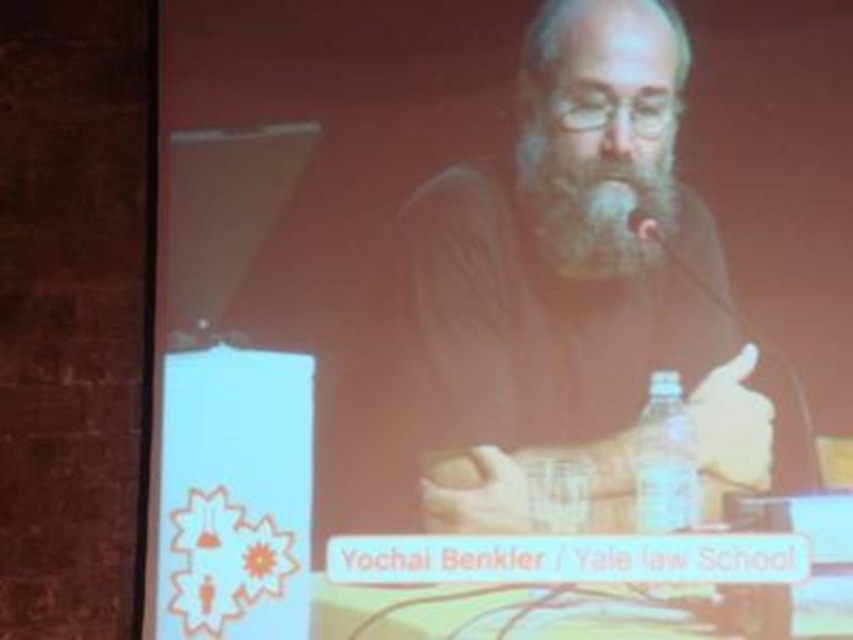
You are a photographer setting up for a presentation. You need to ensure that the white soft beard at center is visible in the frame. Given that the clear plastic bottle at lower right is taller, where should you position the camera to capture both objects without one blocking the other?

Position the camera so that the white soft beard at center is slightly higher in the frame than the clear plastic bottle at lower right. Since the clear plastic bottle at lower right is taller, angling the camera upward will allow the shorter white soft beard at center to be seen above the bottle.

You are sitting in the front row of the lecture hall, and you notice two points marked in the scene. The first point is at coordinates point (672,19) and the second is at point (587,161). Which point is closer to you?

Point (672,19) is further to the camera than point (587,161), so the second point is closer to you.

You are organizing a photo shoot and need to ensure that the smooth skin man at center and the clear plastic bottle at lower right are both visible in the frame. Based on their sizes, which object is more likely to be fully captured in a standard camera shot without cropping?

The smooth skin man at center is wider than the clear plastic bottle at lower right, so the man is more likely to be fully captured without cropping since he occupies more space in the frame.